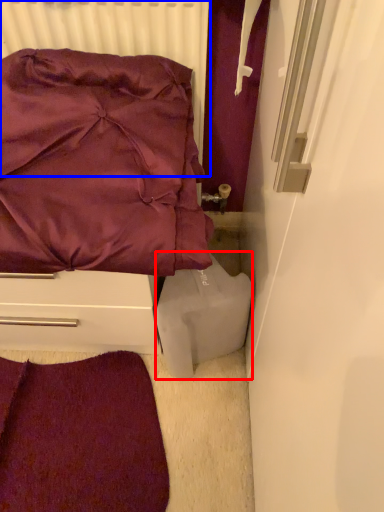
Question: Which point is closer to the camera, wide (highlighted by a red box) or radiator (highlighted by a blue box)?

Choices:
 (A) wide
 (B) radiator

Answer: (B)